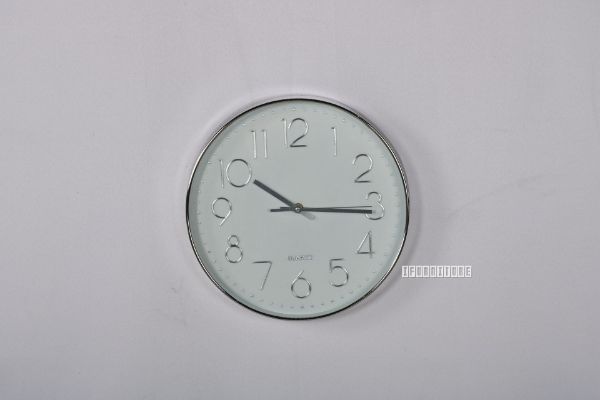
Locate an element on the screen. This screenshot has height=400, width=600. silver bordered wall clock is located at coordinates (191, 242).